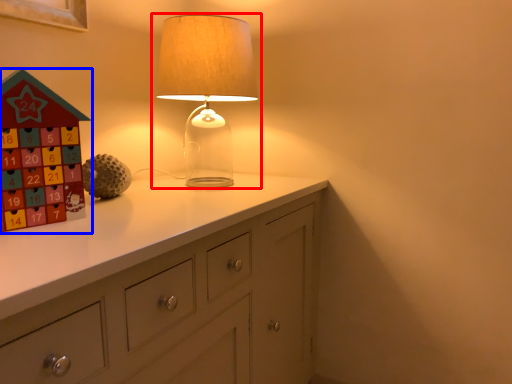
Question: Which object appears farthest to the camera in this image, lamp (highlighted by a red box) or toy (highlighted by a blue box)?

Choices:
 (A) lamp
 (B) toy

Answer: (A)